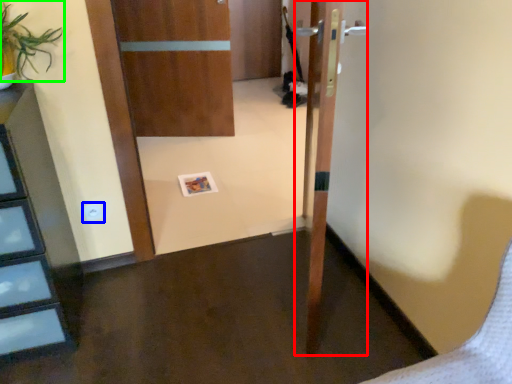
Question: Estimate the real-world distances between objects in this image. Which object is farther from door (highlighted by a red box), electric outlet (highlighted by a blue box) or plant (highlighted by a green box)?

Choices:
 (A) electric outlet
 (B) plant

Answer: (A)